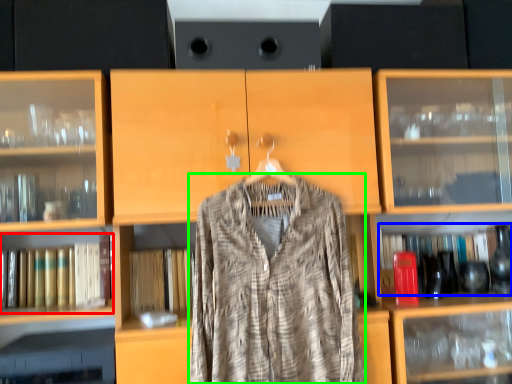
Question: Estimate the real-world distances between objects in this image. Which object is closer to book (highlighted by a red box), book (highlighted by a blue box) or fancy dress (highlighted by a green box)?

Choices:
 (A) book
 (B) fancy dress

Answer: (B)